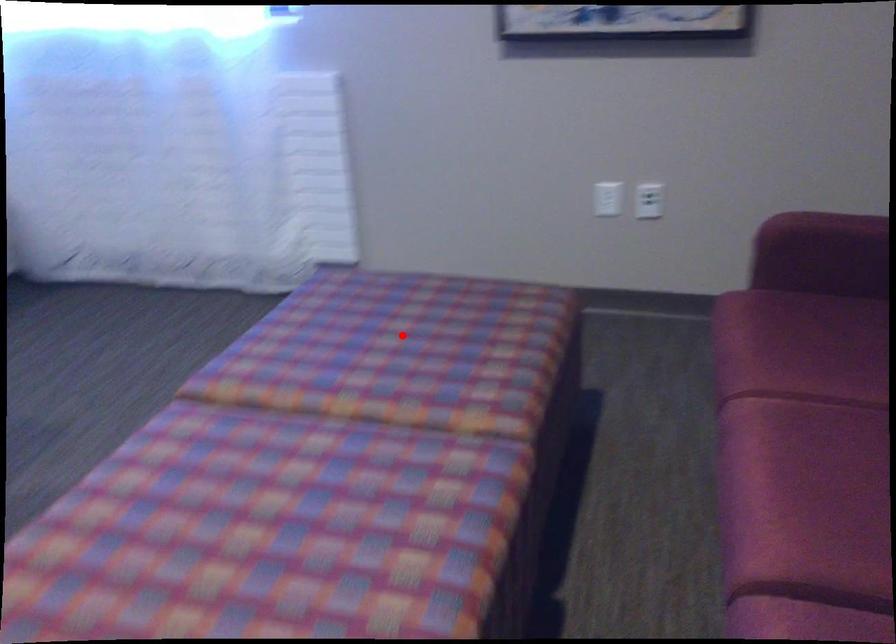
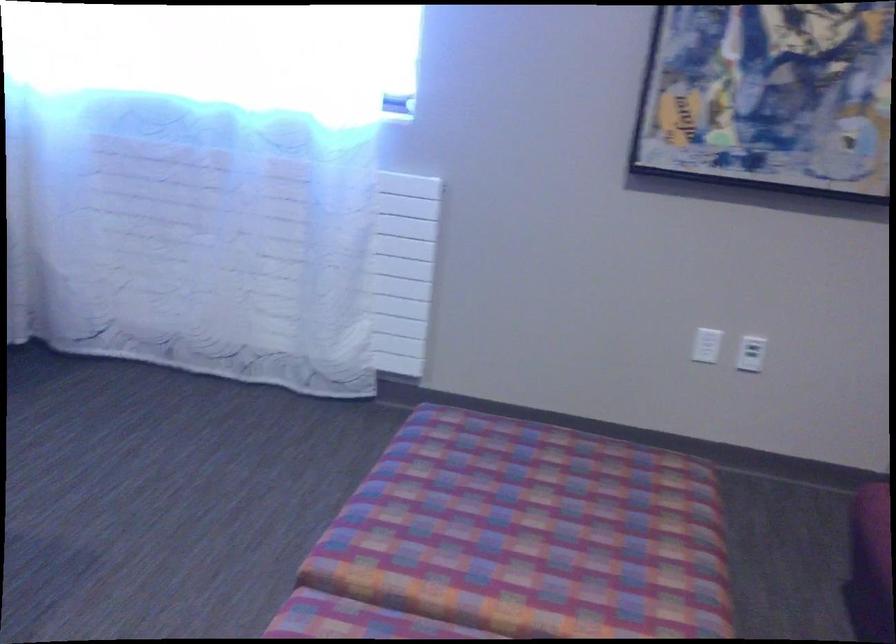
In the second image, find the point that corresponds to the highlighted location in the first image.

(550, 516)